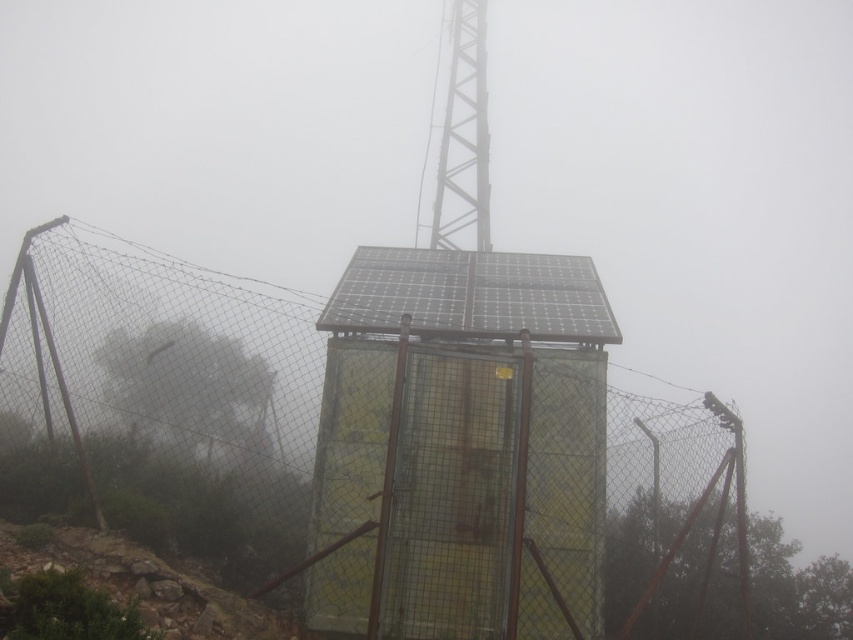
You are a maintenance worker who needs to reach the camera from the metallic yellow cage at center. The maintenance robot you are using has a maximum reach of 4 meters. Can you safely reach the camera without moving the robot?

The metallic yellow cage at center and camera are 4.31 meters apart from each other. Since the robot can only reach 4 meters, you cannot safely reach the camera without moving the robot.

You are a maintenance worker needing to access the camera located near the wire mesh fence at center. The safety regulations state that you must stay at least 4 meters away from the fence. Can you safely perform the maintenance without violating the safety distance requirement?

The wire mesh fence at center and camera are 4.31 meters apart. Since the required safety distance is 4 meters, the distance between them is sufficient, so you can safely perform the maintenance without violating the safety distance requirement.

Based on the photo, you are standing at the center of the image and want to place a new sensor on the ground. The sensor requires a clear, unobstructed area. Based on the scene, is the ground at the coordinates of the metallic yellow cage at center suitable for placing the sensor?

The metallic yellow cage at center is located at coordinates point (461,444), but the scene description mentions it is enclosed by a chain link fence and the structure has solar panels on top. Since the cage is at the center and surrounded by the fence and structure, the ground there may be obstructed by the cage itself or the structure, making it unsuitable for placing the sensor.